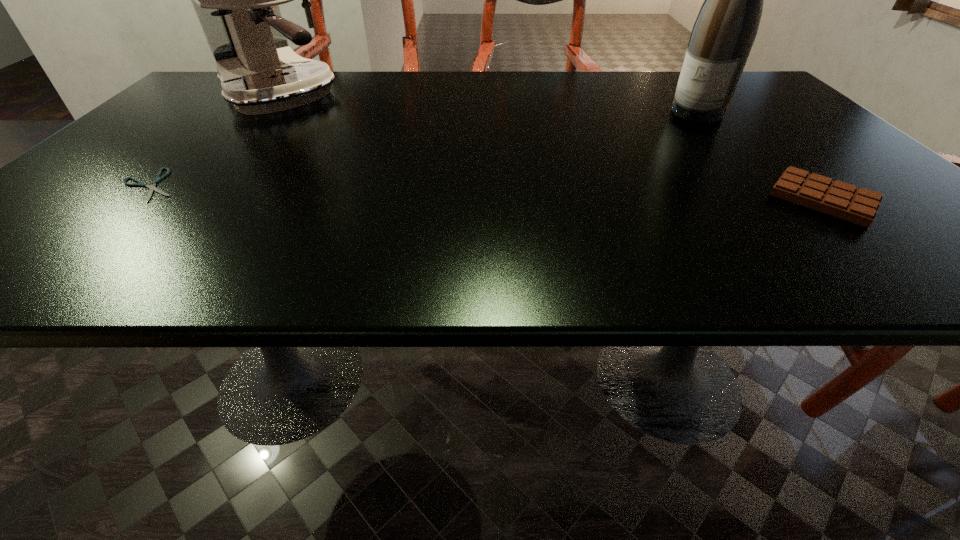
Locate an element on the screen. This screenshot has width=960, height=540. shears is located at coordinates (152, 187).

At what (x,y) coordinates should I click in order to perform the action: click on the third tallest object. Please return your answer as a coordinate pair (x, y). This screenshot has height=540, width=960. Looking at the image, I should click on (836, 198).

Locate an element on the screen. The width and height of the screenshot is (960, 540). wine bottle is located at coordinates (722, 37).

At what (x,y) coordinates should I click in order to perform the action: click on coffee maker. Please return your answer as a coordinate pair (x, y). Looking at the image, I should click on (236, 0).

The width and height of the screenshot is (960, 540). What are the coordinates of `blank area located 0.160m on the back of the shears` in the screenshot? It's located at (205, 131).

Where is `blank area located on the left of the candy bar`? The image size is (960, 540). blank area located on the left of the candy bar is located at coordinates (657, 199).

Identify the location of free space located on the label of the wine bottle. (594, 183).

Identify the location of vacant space located 0.070m on the label of the wine bottle. (671, 130).

Where is `free location located 0.370m on the label of the wine bottle`? Image resolution: width=960 pixels, height=540 pixels. free location located 0.370m on the label of the wine bottle is located at coordinates (594, 183).

Locate an element on the screen. The image size is (960, 540). free space located on the front-facing side of the coffee maker is located at coordinates (364, 158).